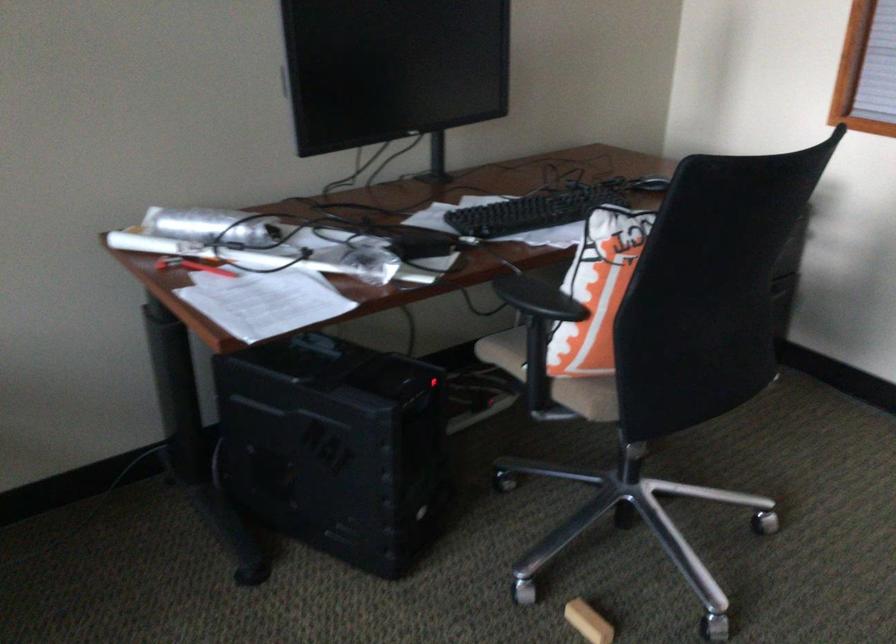
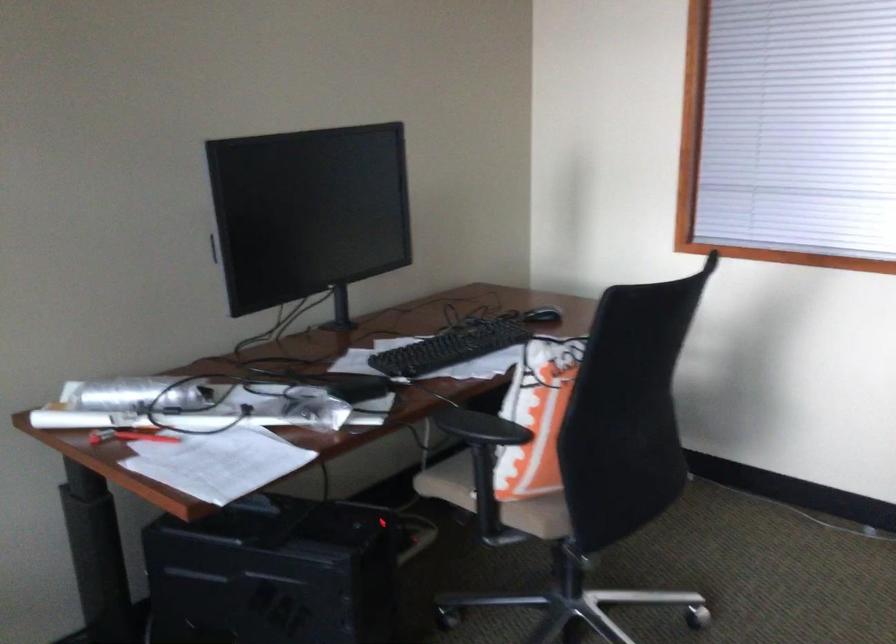
Question: The camera is either moving clockwise (left) or counter-clockwise (right) around the object. The first image is from the beginning of the video and the second image is from the end. Is the camera moving left or right when shooting the video?

Choices:
 (A) Left
 (B) Right

Answer: (A)